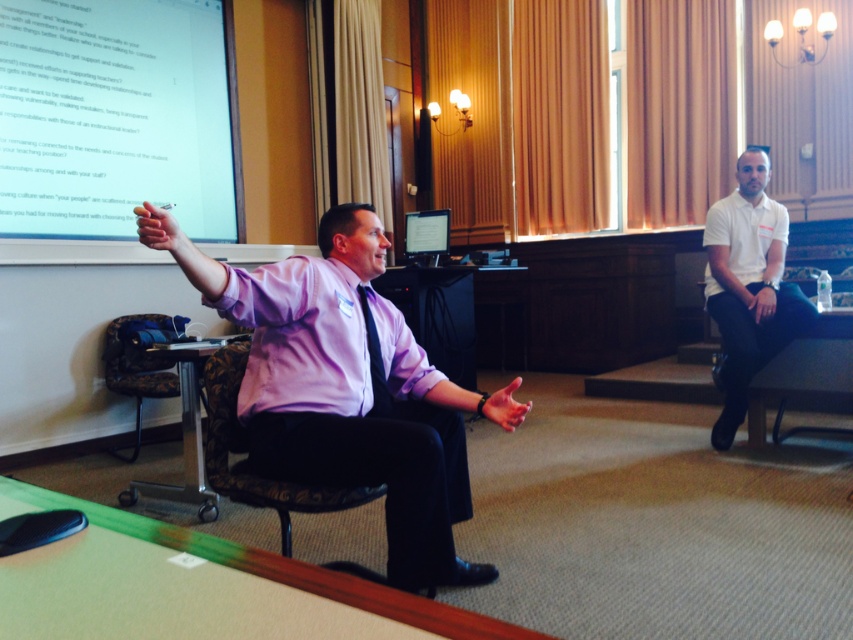
You are a tailor who needs to determine which item requires more fabric for alterations between the purple satin dress shirt at center and the black satin tie at center. Based on the image, which one would need more fabric?

The purple satin dress shirt at center is larger in size than the black satin tie at center, so it would require more fabric for alterations.